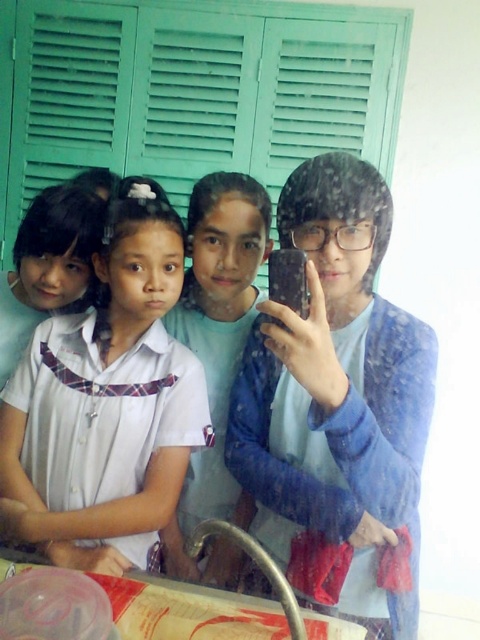
Question: Is white fabric shirt at center below matte blue shirt at center?

Choices:
 (A) yes
 (B) no

Answer: (B)

Question: Which object appears farthest from the camera in this image?

Choices:
 (A) white fabric shirt at center
 (B) matte blue shirt at center
 (C) blue fabric shirt at center

Answer: (B)

Question: Based on their relative distances, which object is nearer to the matte blue shirt at center?

Choices:
 (A) blue fabric shirt at center
 (B) white fabric shirt at center

Answer: (B)

Question: Does white fabric shirt at center have a larger size compared to matte blue shirt at center?

Choices:
 (A) no
 (B) yes

Answer: (B)

Question: Does blue fabric shirt at center lie in front of white fabric shirt at center?

Choices:
 (A) no
 (B) yes

Answer: (B)

Question: Estimate the real-world distances between objects in this image. Which object is closer to the blue fabric shirt at center?

Choices:
 (A) white fabric shirt at center
 (B) matte blue shirt at center

Answer: (A)